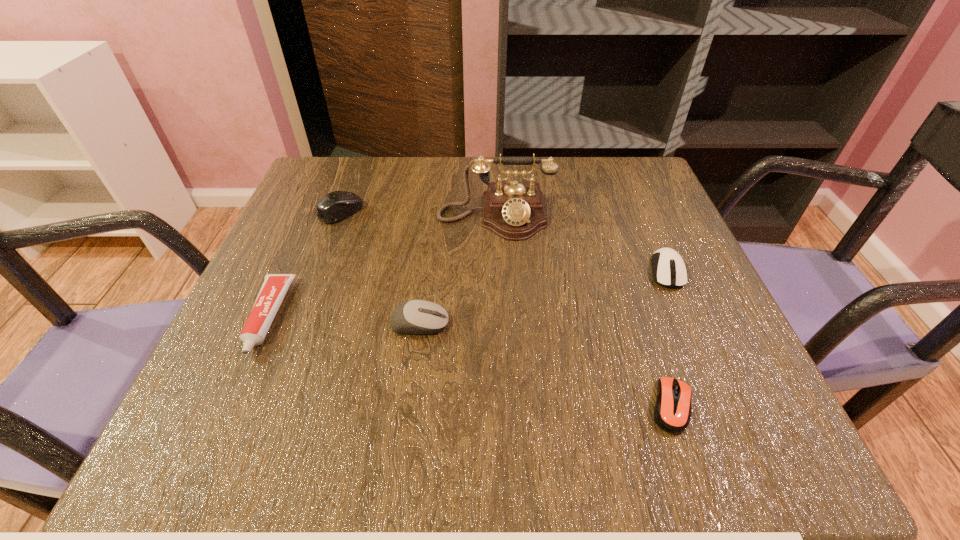
The width and height of the screenshot is (960, 540). Find the location of `free space that satisfies the following two spatial constraints: 1. on the wheel side of the second computer mouse from left to right; 2. on the right side of the shortest object`. free space that satisfies the following two spatial constraints: 1. on the wheel side of the second computer mouse from left to right; 2. on the right side of the shortest object is located at coordinates (410, 406).

Locate an element on the screen. blank space that satisfies the following two spatial constraints: 1. on the dial of the rightmost computer mouse; 2. on the right side of the telephone is located at coordinates (497, 271).

Locate an element on the screen. The height and width of the screenshot is (540, 960). free space that satisfies the following two spatial constraints: 1. on the wheel side of the third farthest computer mouse; 2. on the back side of the nearest computer mouse is located at coordinates (410, 406).

In order to click on vacant space that satisfies the following two spatial constraints: 1. at the nozzle of the fifth object from left to right; 2. on the left side of the toothpaste in this screenshot , I will do `click(228, 406)`.